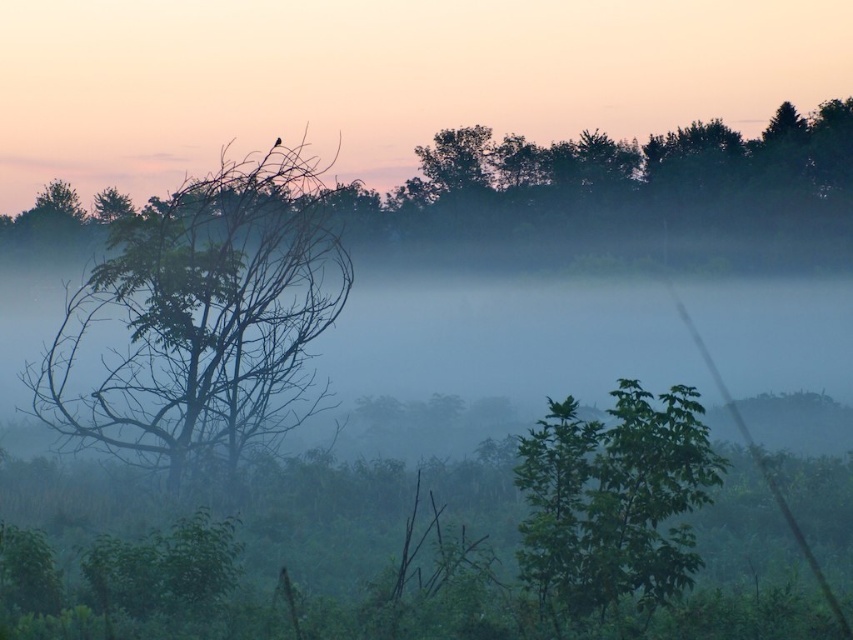
Does green matte tree at left have a larger size compared to green leafy tree at upper center?

Actually, green matte tree at left might be smaller than green leafy tree at upper center.

Is point (126, 332) closer to viewer compared to point (352, 218)?

Yes.

Is point (265, 394) positioned behind point (599, 212)?

That is False.

Image resolution: width=853 pixels, height=640 pixels. What are the coordinates of `green matte tree at left` in the screenshot? It's located at (202, 316).

Does green matte tree at left come in front of silvery metallic bird at upper center?

Yes, it is in front of silvery metallic bird at upper center.

Does green matte tree at left have a lesser height compared to silvery metallic bird at upper center?

No.

Which is behind, point (235, 252) or point (274, 141)?

Point (274, 141)

Identify the location of green matte tree at left. (202, 316).

Does silhouetted tree at left have a lesser width compared to silvery metallic bird at upper center?

Incorrect, silhouetted tree at left's width is not less than silvery metallic bird at upper center's.

Who is higher up, silhouetted tree at left or silvery metallic bird at upper center?

silhouetted tree at left is above.

Is point (213, 17) positioned behind point (279, 144)?

Yes, point (213, 17) is farther from viewer.

The image size is (853, 640). Identify the location of silhouetted tree at left. (381, 77).